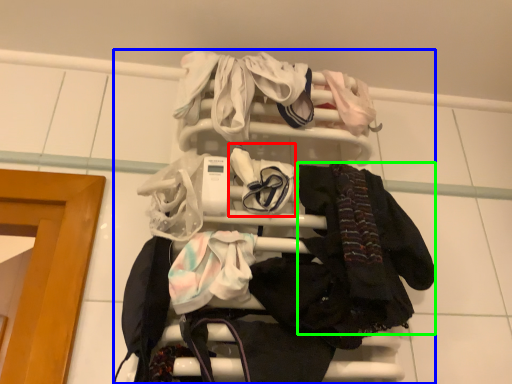
Question: Which object is positioned closest to baby clothe (highlighted by a red box)? Select from bunk bed (highlighted by a blue box) and clothing (highlighted by a green box).

Choices:
 (A) bunk bed
 (B) clothing

Answer: (A)